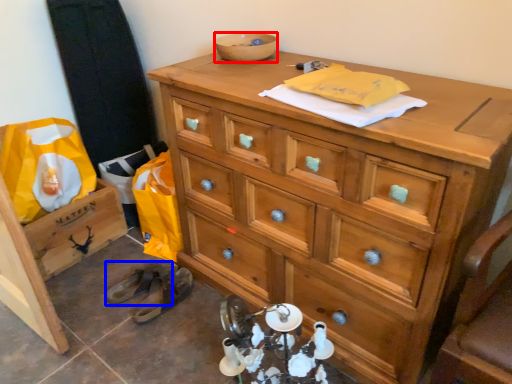
Question: Which object appears closest to the camera in this image, bowl (highlighted by a red box) or shoe (highlighted by a blue box)?

Choices:
 (A) bowl
 (B) shoe

Answer: (A)